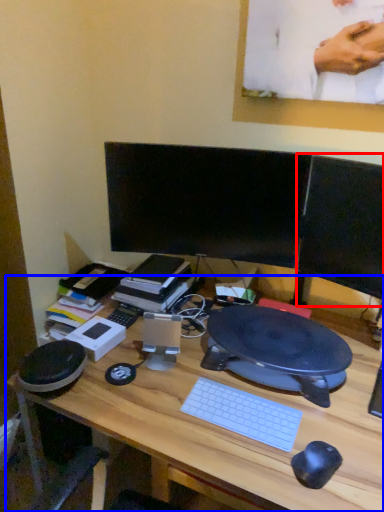
Question: Which object appears farthest to the camera in this image, computer monitor (highlighted by a red box) or desk (highlighted by a blue box)?

Choices:
 (A) computer monitor
 (B) desk

Answer: (A)